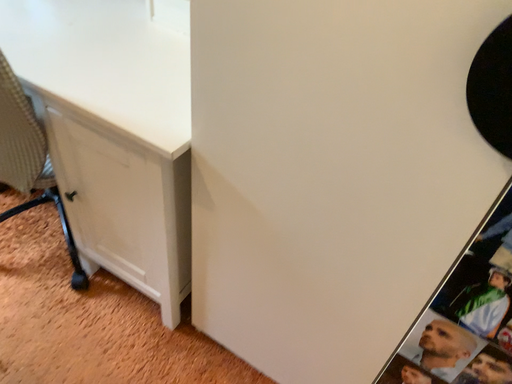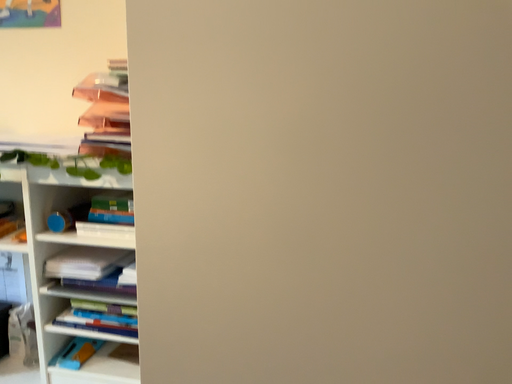
Question: How did the camera likely rotate when shooting the video?

Choices:
 (A) rotated left
 (B) rotated right

Answer: (B)